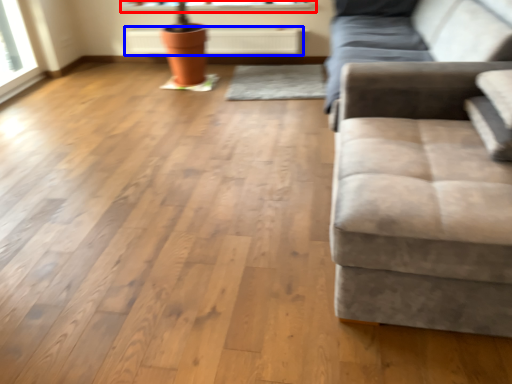
Question: Which point is further to the camera, window sill (highlighted by a red box) or radiator (highlighted by a blue box)?

Choices:
 (A) window sill
 (B) radiator

Answer: (A)